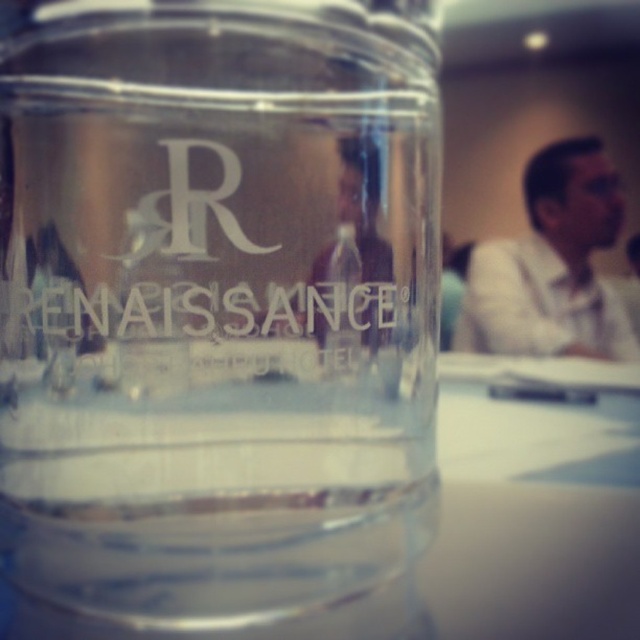
Question: Which point is closer to the camera?

Choices:
 (A) transparent glass at center
 (B) transparent glass jar at center

Answer: (B)

Question: Does transparent glass jar at center appear under whitematerial/texturerenaissance at center?

Choices:
 (A) yes
 (B) no

Answer: (A)

Question: Is transparent glass jar at center behind transparent glass at center?

Choices:
 (A) no
 (B) yes

Answer: (A)

Question: Considering the real-world distances, which object is farthest from the whitematerial/texturerenaissance at center?

Choices:
 (A) transparent glass at center
 (B) transparent glass jar at center

Answer: (A)

Question: Is transparent glass at center closer to camera compared to whitematerial/texturerenaissance at center?

Choices:
 (A) no
 (B) yes

Answer: (B)

Question: Among these points, which one is nearest to the camera?

Choices:
 (A) (204, 324)
 (B) (285, 221)
 (C) (458, 420)

Answer: (A)